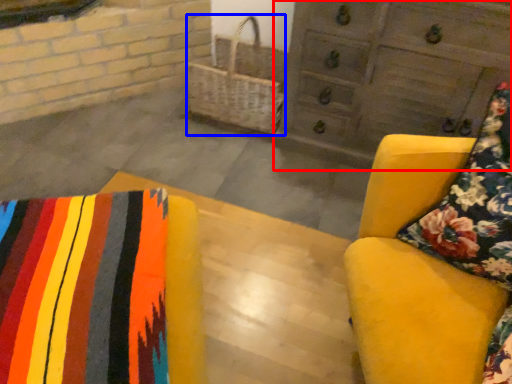
Question: Which point is further to the camera, chest of drawers (highlighted by a red box) or basket (highlighted by a blue box)?

Choices:
 (A) chest of drawers
 (B) basket

Answer: (B)